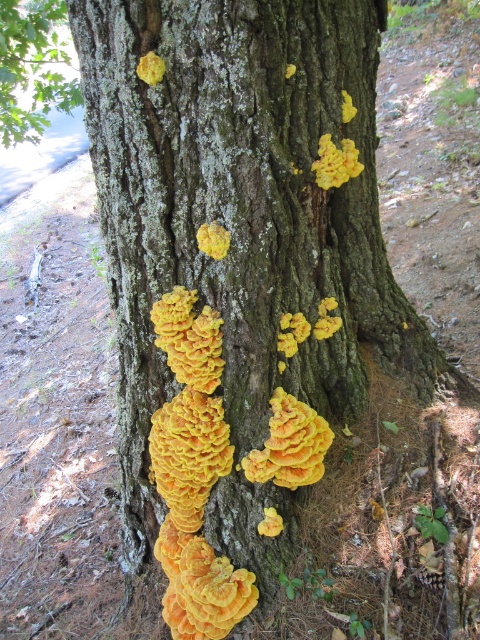
Question: Does yellow crusty fungus at center appear under yellow/orange wood-like at center?

Choices:
 (A) yes
 (B) no

Answer: (A)

Question: Where is yellow sponge-like fungi at center located in relation to yellow crusty fungus at upper center in the image?

Choices:
 (A) below
 (B) above

Answer: (A)

Question: Which object is the closest to the yellow sponge-like fungi at center?

Choices:
 (A) yellow matte fungus at upper left
 (B) yellow textured fungi at center

Answer: (B)

Question: Which point is farther to the camera?

Choices:
 (A) (182, 308)
 (B) (220, 240)
 (C) (144, 68)

Answer: (A)

Question: In this image, where is yellow crusty fungus at center located relative to yellow matte fungus at upper left?

Choices:
 (A) below
 (B) above

Answer: (A)

Question: Which of the following is the closest to the observer?

Choices:
 (A) (216, 596)
 (B) (316, 420)
 (C) (216, 234)

Answer: (C)